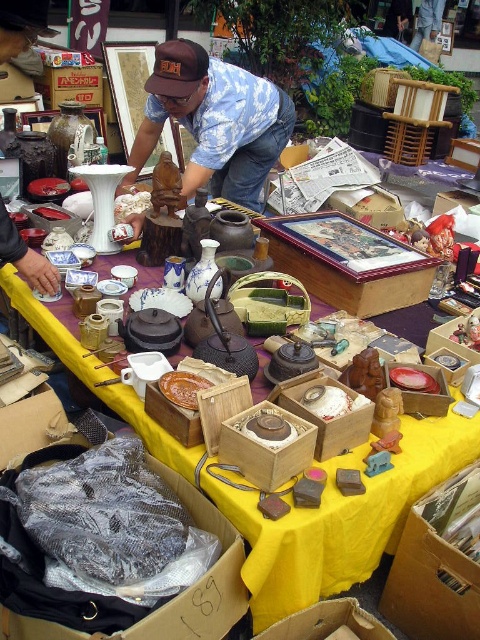
Between wooden box with painted picture at center and white matte rice at center, which one has more height?

wooden box with painted picture at center is taller.

Does wooden box with painted picture at center appear on the left side of white matte rice at center?

In fact, wooden box with painted picture at center is to the right of white matte rice at center.

Is point (343, 269) positioned behind point (311, 397)?

Yes, point (343, 269) is farther from viewer.

In order to click on wooden box with painted picture at center in this screenshot , I will do `click(348, 262)`.

Is plastic wrapped cloth at lower left in front of cardboard box at lower center?

Yes, it is in front of cardboard box at lower center.

Is point (153, 611) farther from camera compared to point (323, 616)?

That is False.

Locate an element on the screen. The width and height of the screenshot is (480, 640). plastic wrapped cloth at lower left is located at coordinates (115, 552).

Locate an element on the screen. This screenshot has height=640, width=480. brown fabric cap at upper center is located at coordinates (177, 68).

Who is more distant from viewer, (156, 61) or (188, 381)?

Point (156, 61)

Which is behind, point (160, 96) or point (166, 385)?

The point (160, 96) is behind.

You are a GUI agent. You are given a task and a screenshot of the screen. Output one action in this format:
    pyautogui.click(x=<x>, y=<y>)
    Task: Click on the brown fabric cap at upper center
    This screenshot has width=480, height=640.
    Given the screenshot: What is the action you would take?
    pyautogui.click(x=177, y=68)